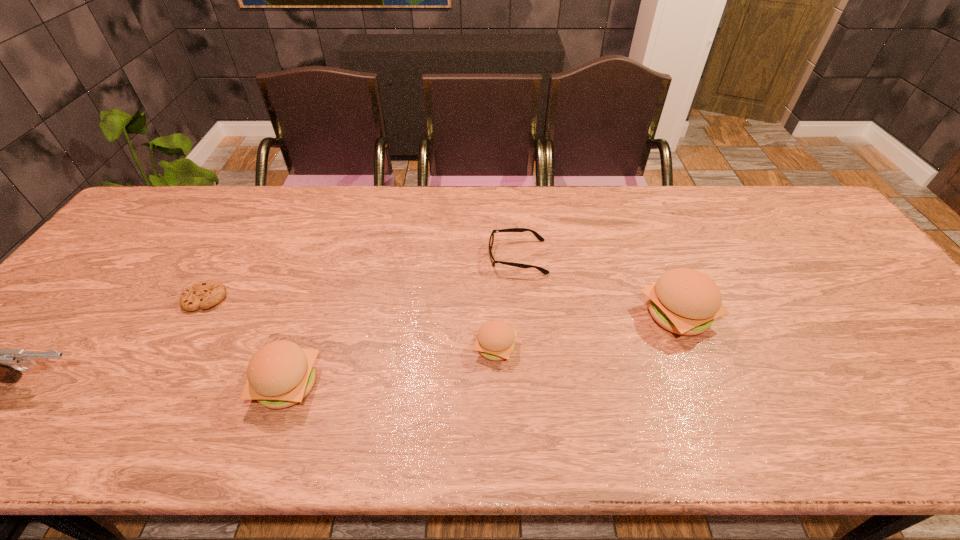
In the image, there is a desktop. Where is `free space at the right edge`? Image resolution: width=960 pixels, height=540 pixels. free space at the right edge is located at coordinates (x=814, y=263).

Where is `vacant space at the far right corner of the desktop`? Image resolution: width=960 pixels, height=540 pixels. vacant space at the far right corner of the desktop is located at coordinates (789, 197).

At what (x,y) coordinates should I click in order to perform the action: click on free point at the near right corner. Please return your answer as a coordinate pair (x, y). Looking at the image, I should click on (912, 402).

This screenshot has height=540, width=960. In order to click on empty location between the second object from left to right and the third shortest object in this screenshot , I will do `click(350, 323)`.

In order to click on blank region between the shortest hamburger and the rightmost hamburger in this screenshot , I will do `click(587, 331)`.

You are a GUI agent. You are given a task and a screenshot of the screen. Output one action in this format:
    pyautogui.click(x=<x>, y=<y>)
    Task: Click on the free space between the leftmost hamburger and the fifth object from right to left
    The width and height of the screenshot is (960, 540).
    Given the screenshot: What is the action you would take?
    pyautogui.click(x=247, y=341)

The height and width of the screenshot is (540, 960). I want to click on free space between the fifth object from right to left and the spectacles, so click(362, 278).

Find the location of a particular element. Image resolution: width=960 pixels, height=540 pixels. empty space between the second hamburger from right to left and the second shortest object is located at coordinates (507, 302).

The image size is (960, 540). In order to click on object that is the second closest to the second hamburger from left to right in this screenshot , I will do `click(684, 301)`.

Locate which object is the fifth closest to the fourth tallest object. Please provide its 2D coordinates. Your answer should be formatted as a tuple, i.e. [(x, y)], where the tuple contains the x and y coordinates of a point satisfying the conditions above.

[(0, 365)]